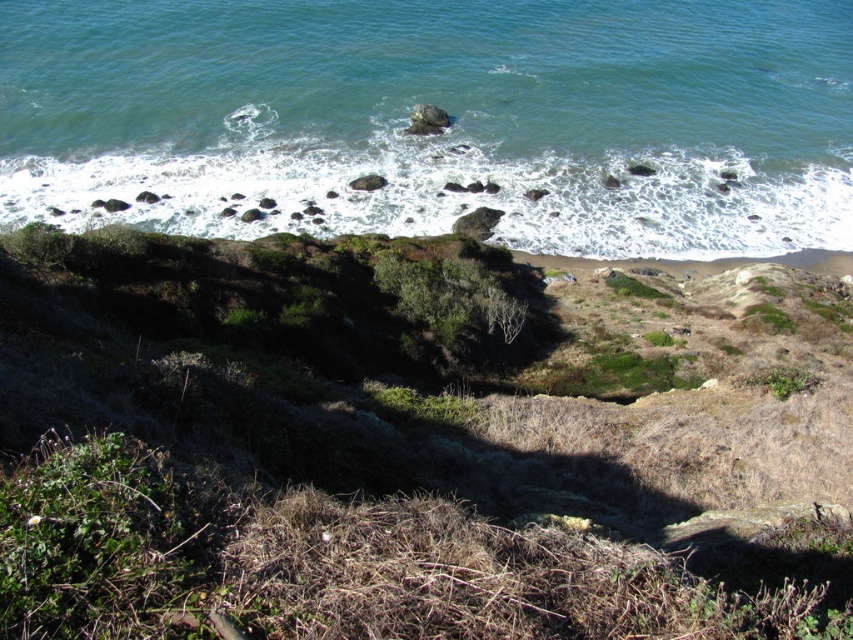
You are standing at the top of the green grassy hillside at center and want to walk down to the beach. Which direction should you head to reach the beach?

The green grassy hillside at center is located at point (412, 445), so you should head towards the lower area to reach the beach.

You are standing on the rugged terrain in the foreground of the coastal landscape. You want to walk towards the clear blue water at upper center. Which direction should you go relative to the green grassy hillside at center?

You should head towards the clear blue water at upper center, which is above the green grassy hillside at center. Since the green grassy hillside at center is below the water, you would need to move upward or in the direction away from the rugged foreground towards the upper part of the scene.

From the picture: You are a hiker planning to cross the green grassy hillside at center and the clear blue water at upper center. Which area would require more time to traverse due to its size?

The clear blue water at upper center would take more time to traverse because it is larger in size compared to the green grassy hillside at center.